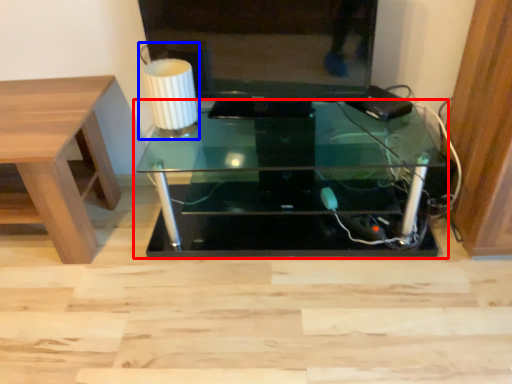
Question: Among these objects, which one is nearest to the camera, table (highlighted by a red box) or table lamp (highlighted by a blue box)?

Choices:
 (A) table
 (B) table lamp

Answer: (A)